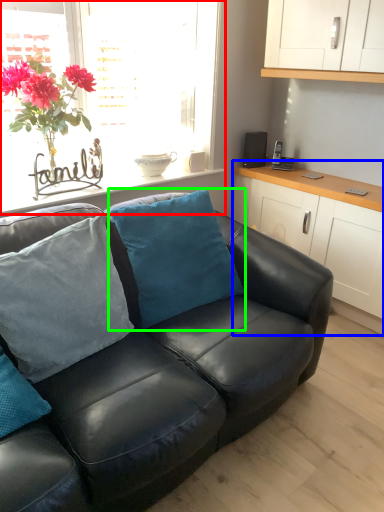
Question: Which object is positioned farthest from window (highlighted by a red box)? Select from cabinetry (highlighted by a blue box) and pillow (highlighted by a green box).

Choices:
 (A) cabinetry
 (B) pillow

Answer: (A)